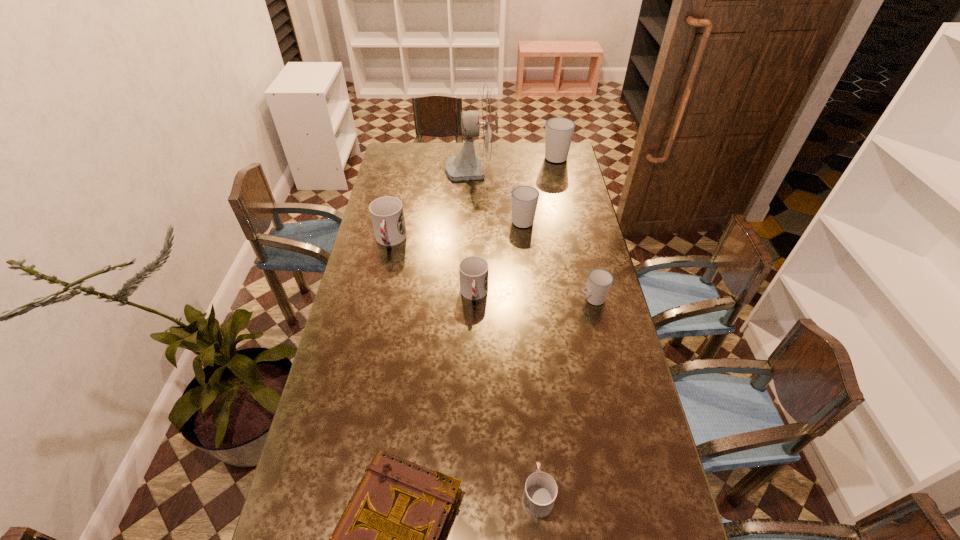
What are the coordinates of `the nearest white cup` in the screenshot? It's located at (599, 283).

Find the location of a particular element. The width and height of the screenshot is (960, 540). the rightmost red cup is located at coordinates (540, 492).

Identify the location of the smallest red cup. This screenshot has width=960, height=540. (540, 492).

Locate an element on the screen. vacant region located 0.110m in front of the white fan to blow air is located at coordinates (519, 168).

Identify the location of blank space located 0.230m on the side of the biggest red cup where the handle is located. (377, 300).

This screenshot has height=540, width=960. In order to click on free space located 0.270m with a handle on the side of the second smallest white cup in this screenshot , I will do `click(517, 176)`.

In order to click on vacant area situated 0.180m with a handle on the side of the second smallest white cup in this screenshot , I will do `click(519, 187)`.

Find the location of `vacant region located 0.280m with a handle on the side of the second smallest white cup`. vacant region located 0.280m with a handle on the side of the second smallest white cup is located at coordinates (517, 174).

Identify the location of free location located on the side of the second red cup from left to right where the handle is located. Image resolution: width=960 pixels, height=540 pixels. (473, 390).

You are a GUI agent. You are given a task and a screenshot of the screen. Output one action in this format:
    pyautogui.click(x=<x>, y=<y>)
    Task: Click on the vacant space located 0.110m with a handle on the side of the smallest white cup
    
    Given the screenshot: What is the action you would take?
    pyautogui.click(x=548, y=299)